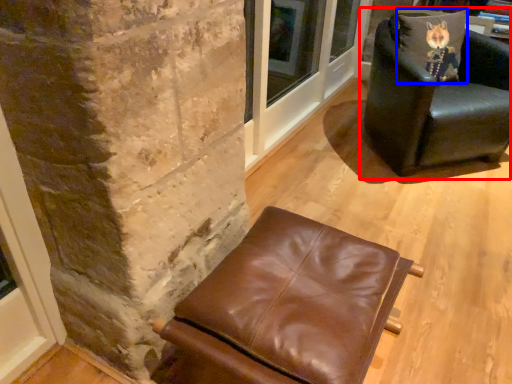
Question: Among these objects, which one is nearest to the camera, chair (highlighted by a red box) or pillow (highlighted by a blue box)?

Choices:
 (A) chair
 (B) pillow

Answer: (A)